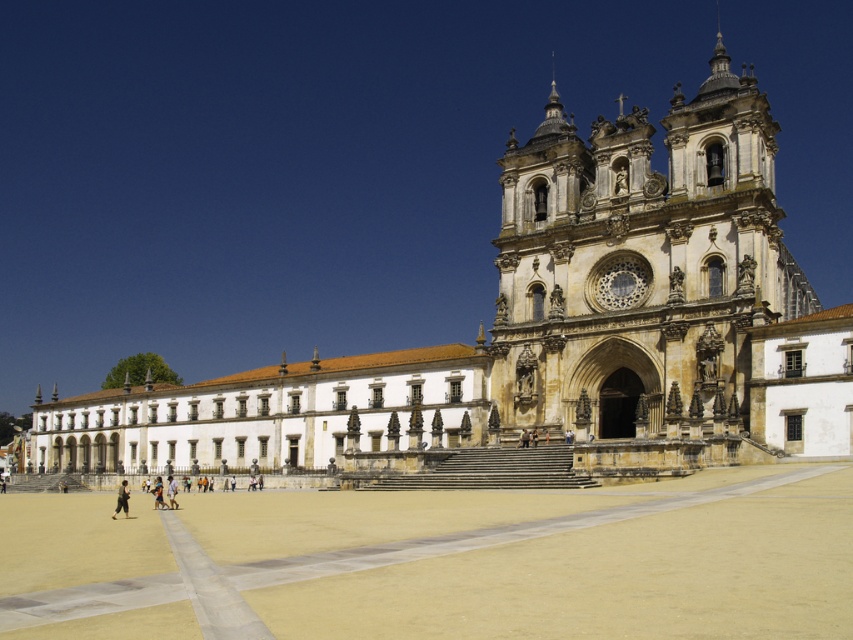
Is beige stone tower at center below dark gray fabric pants at lower left?

No, beige stone tower at center is not below dark gray fabric pants at lower left.

From the picture: Measure the distance between point (550, 186) and camera.

The distance of point (550, 186) from camera is 75.03 meters.

What do you see at coordinates (641, 280) in the screenshot? I see `beige stone tower at center` at bounding box center [641, 280].

I want to click on beige stone tower at center, so click(x=641, y=280).

Between white stone church at center and dark gray fabric pants at lower left, which one is positioned lower?

dark gray fabric pants at lower left is lower down.

Is white stone church at center behind dark gray fabric pants at lower left?

That is True.

What are the coordinates of `white stone church at center` in the screenshot? It's located at (374, 170).

Is white stone church at center bigger than beige stone tower at center?

Yes.

Does white stone church at center lie behind beige stone tower at center?

Yes, white stone church at center is behind beige stone tower at center.

Between point (825, 44) and point (517, 372), which one is positioned behind?

The point (825, 44) is more distant.

Where is `white stone church at center`? The image size is (853, 640). white stone church at center is located at coordinates (374, 170).